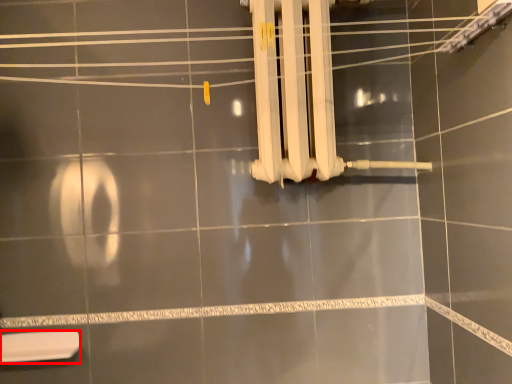
Question: Where is toilet (annotated by the red box) located in relation to shower in the image?

Choices:
 (A) right
 (B) left

Answer: (B)